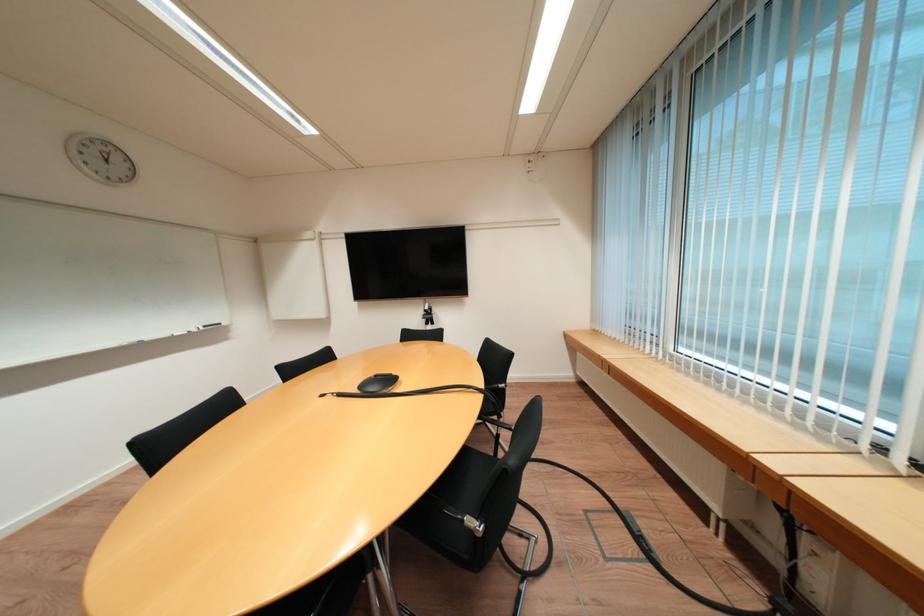
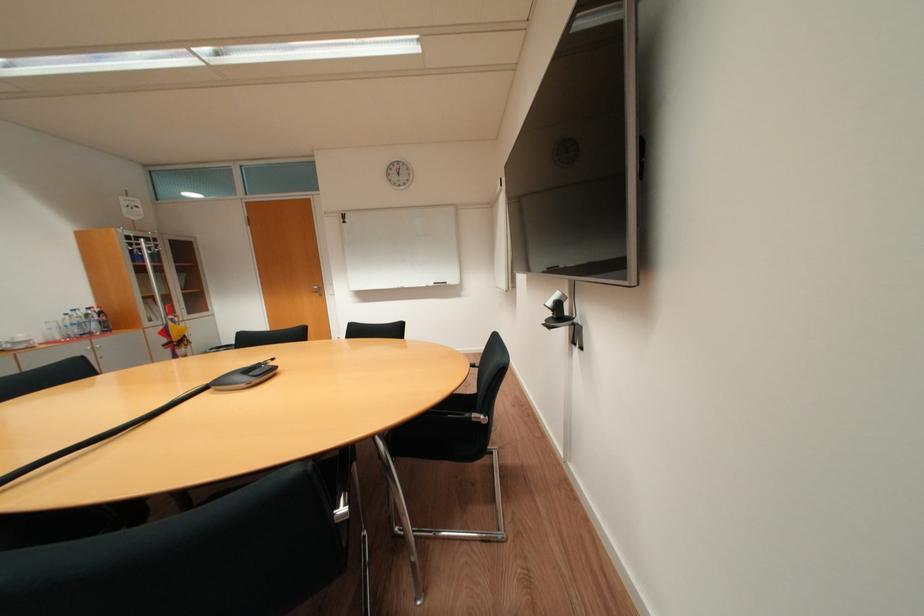
Locate, in the second image, the point that corresponds to point 435,310 in the first image.

(558, 304)